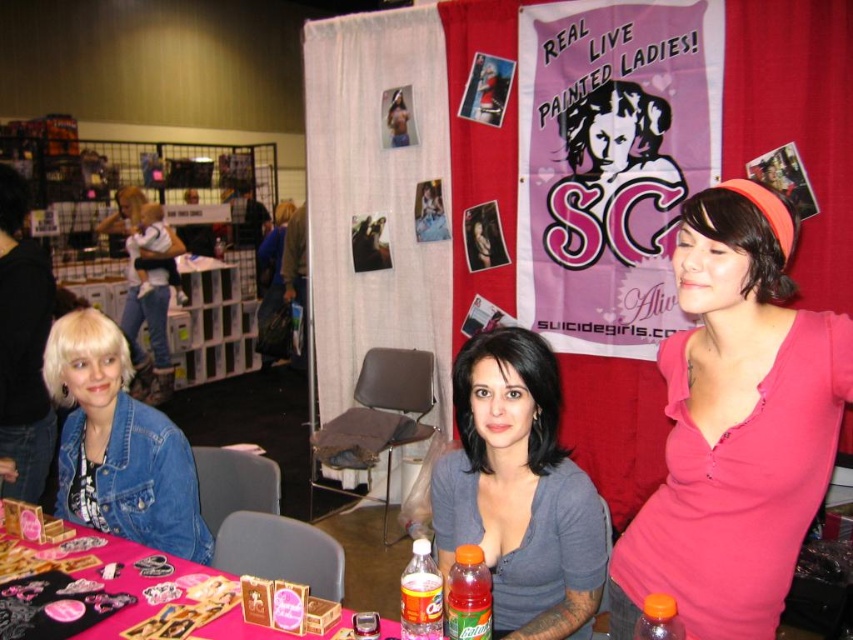
Image resolution: width=853 pixels, height=640 pixels. Describe the element at coordinates (735, 426) in the screenshot. I see `pink fabric shirt at right` at that location.

Which is behind, point (815, 440) or point (416, 624)?

The point (416, 624) is more distant.

Locate an element on the screen. This screenshot has height=640, width=853. pink fabric shirt at right is located at coordinates (735, 426).

In the scene shown: Between pink fabric shirt at right and pink fabric table at lower left, which one appears on the left side from the viewer's perspective?

From the viewer's perspective, pink fabric table at lower left appears more on the left side.

Which of these two, pink fabric shirt at right or pink fabric table at lower left, stands shorter?

pink fabric table at lower left

The height and width of the screenshot is (640, 853). Describe the element at coordinates (735, 426) in the screenshot. I see `pink fabric shirt at right` at that location.

The image size is (853, 640). Identify the location of pink fabric shirt at right. (735, 426).

Which of these two, pink fabric shirt at right or translucent plastic soda bottle at center, stands shorter?

With less height is translucent plastic soda bottle at center.

Which is below, pink fabric shirt at right or translucent plastic soda bottle at center?

translucent plastic soda bottle at center is below.

Between point (741, 445) and point (456, 580), which one is positioned in front?

Point (741, 445) is in front.

Find the location of a particular element. This screenshot has width=853, height=640. pink fabric shirt at right is located at coordinates (735, 426).